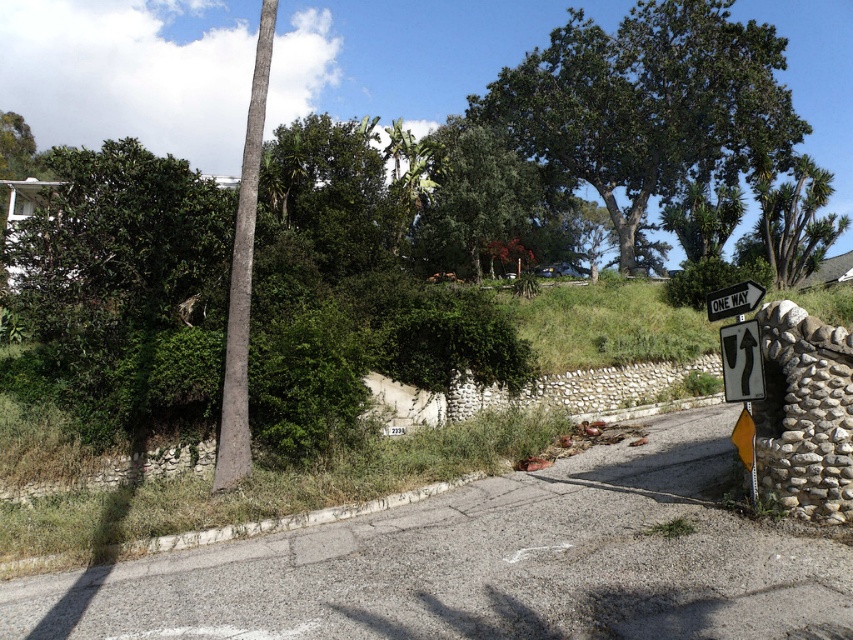
Is green leafy tree at upper center taller than metallic reflective one way sign at right?

Yes, green leafy tree at upper center is taller than metallic reflective one way sign at right.

Can you confirm if green leafy tree at upper center is positioned to the left of metallic reflective one way sign at right?

Incorrect, green leafy tree at upper center is not on the left side of metallic reflective one way sign at right.

The height and width of the screenshot is (640, 853). Find the location of `green leafy tree at upper center`. green leafy tree at upper center is located at coordinates (648, 104).

Locate an element on the screen. This screenshot has width=853, height=640. green leafy tree at upper center is located at coordinates (648, 104).

Can you confirm if smooth gray pole at upper left is taller than metallic reflective one way sign at right?

Indeed, smooth gray pole at upper left has a greater height compared to metallic reflective one way sign at right.

Which is behind, point (248, 202) or point (746, 284)?

The point (248, 202) is behind.

Locate an element on the screen. This screenshot has height=640, width=853. smooth gray pole at upper left is located at coordinates (242, 275).

Locate an element on the screen. smooth gray pole at upper left is located at coordinates (242, 275).

Who is more distant from viewer, (798, 225) or (738, 288)?

Positioned behind is point (798, 225).

The height and width of the screenshot is (640, 853). I want to click on green leafy tree at upper right, so click(795, 220).

At what (x,y) coordinates should I click in order to perform the action: click on green leafy tree at upper right. Please return your answer as a coordinate pair (x, y). The height and width of the screenshot is (640, 853). Looking at the image, I should click on (795, 220).